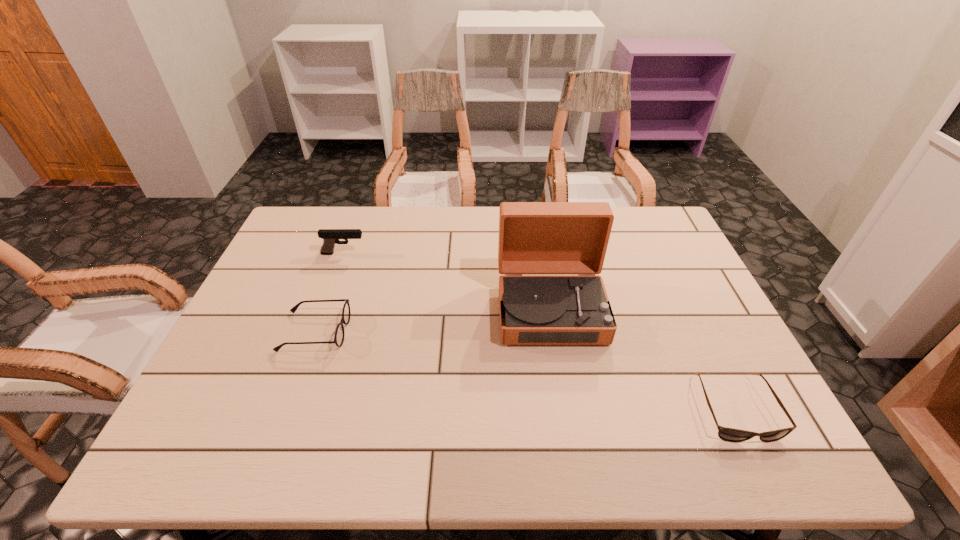
Where is `the second object from right to left`? the second object from right to left is located at coordinates (534, 237).

Locate an element on the screen. This screenshot has height=540, width=960. phonograph record is located at coordinates (534, 237).

Identify the location of the third shortest object. (330, 237).

Where is `pistol`? This screenshot has width=960, height=540. pistol is located at coordinates (330, 237).

Where is `the second shortest object`? Image resolution: width=960 pixels, height=540 pixels. the second shortest object is located at coordinates pyautogui.click(x=339, y=333).

Identify the location of the rightmost object. The width and height of the screenshot is (960, 540). (726, 434).

At what (x,y) coordinates should I click in order to perform the action: click on the nearest object. Please return your answer as a coordinate pair (x, y). Looking at the image, I should click on (726, 434).

Identify the location of vacant space located 0.250m on the face of the second object from right to left. [x=572, y=442].

Locate an element on the screen. The width and height of the screenshot is (960, 540). free region located 0.380m on the front-facing side of the farthest object is located at coordinates (488, 254).

What are the coordinates of `vacant area located on the front-facing side of the second shortest object` in the screenshot? It's located at (467, 332).